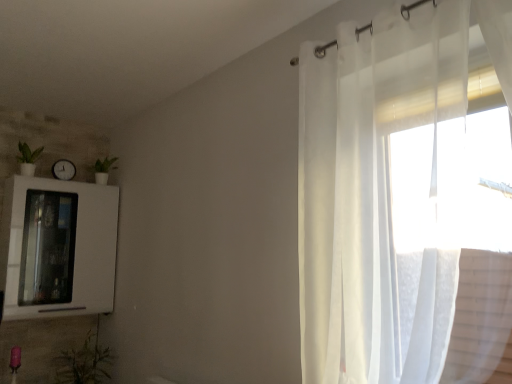
Question: From a real-world perspective, does green matte plant at left, which is counted as the 2th plant, starting from the right, stand above white glossy medicine cabinet at left?

Choices:
 (A) no
 (B) yes

Answer: (B)

Question: Is green matte plant at left, which is counted as the 2th plant, starting from the right, outside of white glossy medicine cabinet at left?

Choices:
 (A) yes
 (B) no

Answer: (A)

Question: Does green matte plant at left, which is counted as the 2th plant, starting from the right, come in front of white glossy medicine cabinet at left?

Choices:
 (A) yes
 (B) no

Answer: (B)

Question: From a real-world perspective, is green matte plant at left, the first plant in the top-to-bottom sequence, physically below white glossy medicine cabinet at left?

Choices:
 (A) no
 (B) yes

Answer: (A)

Question: Can you confirm if green matte plant at left, positioned as the 1th plant in left-to-right order, is taller than white glossy medicine cabinet at left?

Choices:
 (A) no
 (B) yes

Answer: (A)

Question: From the image's perspective, is white glossy medicine cabinet at left positioned above or below green leafy plant at lower left, which ranks as the 2th plant in top-to-bottom order?

Choices:
 (A) above
 (B) below

Answer: (A)

Question: From a real-world perspective, is white glossy medicine cabinet at left physically located above or below green leafy plant at lower left, arranged as the second plant when viewed from the left?

Choices:
 (A) below
 (B) above

Answer: (B)

Question: Is point (61, 289) positioned closer to the camera than point (106, 365)?

Choices:
 (A) closer
 (B) farther

Answer: (A)

Question: Which is correct: white glossy medicine cabinet at left is inside green leafy plant at lower left, which is the first plant from bottom to top, or outside of it?

Choices:
 (A) inside
 (B) outside

Answer: (B)

Question: Considering the positions of point (30, 157) and point (82, 347), is point (30, 157) closer or farther from the camera than point (82, 347)?

Choices:
 (A) farther
 (B) closer

Answer: (A)

Question: Considering their positions, is green matte plant at left, which is counted as the 2th plant, starting from the right, located in front of or behind green leafy plant at lower left, which ranks as the 2th plant in top-to-bottom order?

Choices:
 (A) front
 (B) behind

Answer: (B)

Question: Looking at their shapes, would you say green matte plant at left, positioned as the 1th plant in left-to-right order, is wider or thinner than green leafy plant at lower left, the first plant when ordered from right to left?

Choices:
 (A) wide
 (B) thin

Answer: (B)

Question: From the image's perspective, is green matte plant at left, positioned as the 1th plant in left-to-right order, above or below green leafy plant at lower left, arranged as the second plant when viewed from the left?

Choices:
 (A) above
 (B) below

Answer: (A)

Question: Which is correct: sheer white curtain at right is inside white glossy medicine cabinet at left, or outside of it?

Choices:
 (A) inside
 (B) outside

Answer: (B)

Question: From the image's perspective, relative to white glossy medicine cabinet at left, is sheer white curtain at right above or below?

Choices:
 (A) above
 (B) below

Answer: (A)